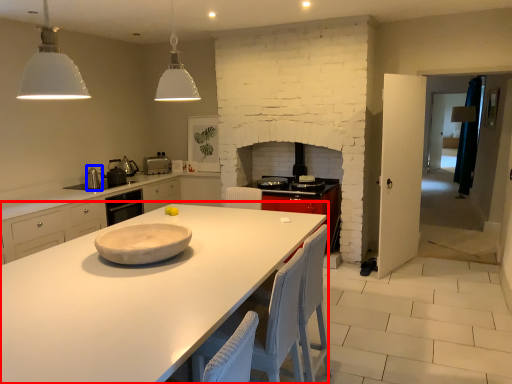
Question: Which object appears closest to the camera in this image, countertop (highlighted by a red box) or appliance (highlighted by a blue box)?

Choices:
 (A) countertop
 (B) appliance

Answer: (A)